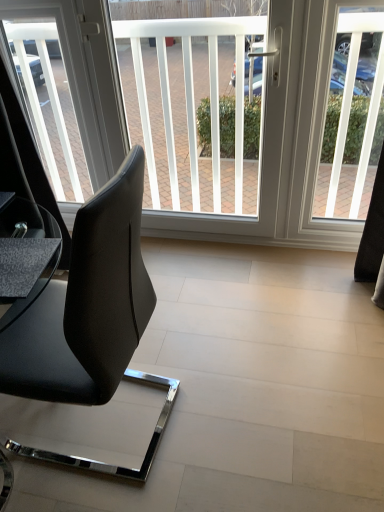
Where is `vacant space in white plastic window screen at center, the 2th window screen in the left-to-right sequence (from a real-world perspective)`? vacant space in white plastic window screen at center, the 2th window screen in the left-to-right sequence (from a real-world perspective) is located at coordinates (206, 244).